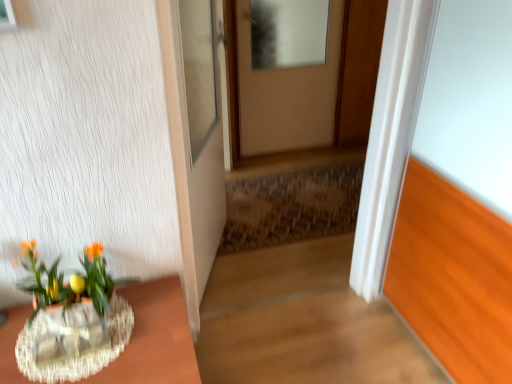
Image resolution: width=512 pixels, height=384 pixels. I want to click on free spot above translucent glass vase at lower left (from a real-world perspective), so (73, 347).